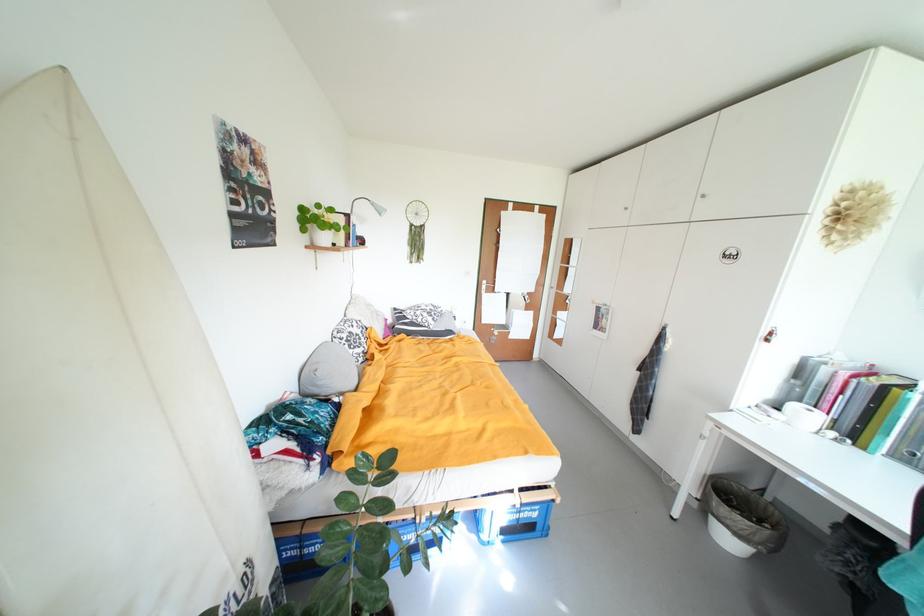
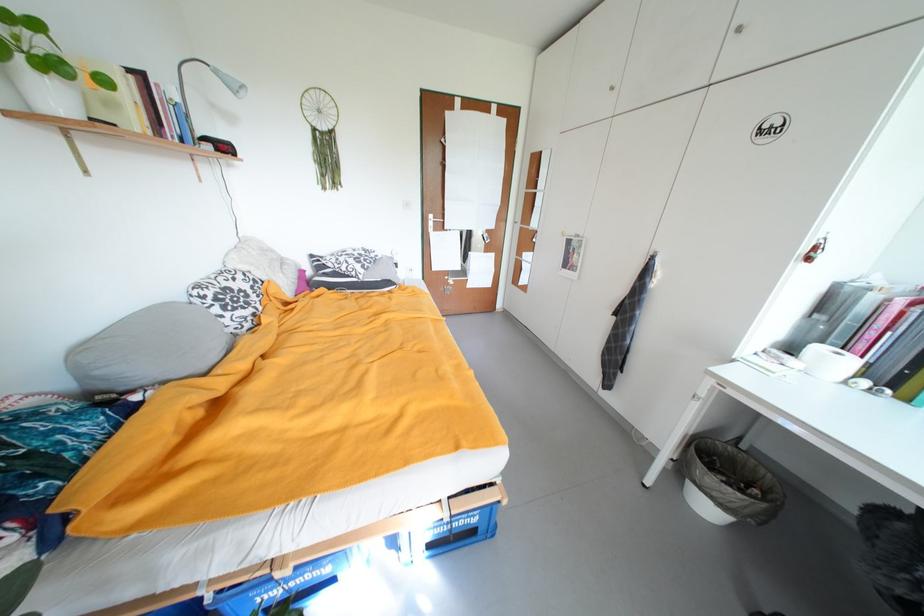
The point at (492, 284) is marked in the first image. Where is the corresponding point in the second image?

(439, 217)